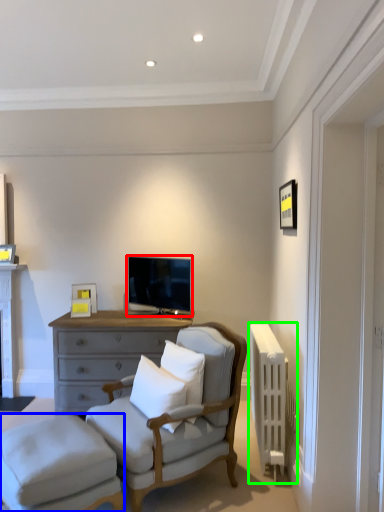
Question: Estimate the real-world distances between objects in this image. Which object is closer to television (highlighted by a red box), stool (highlighted by a blue box) or radiator (highlighted by a green box)?

Choices:
 (A) stool
 (B) radiator

Answer: (B)